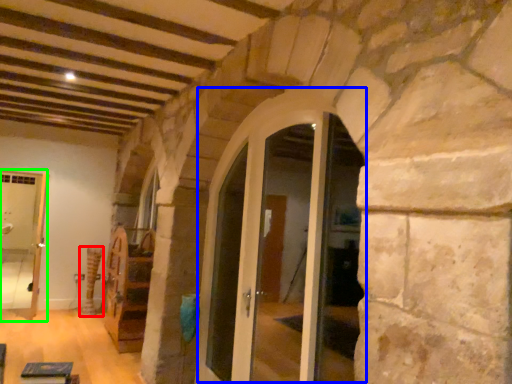
Question: Considering the real-world distances, which object is closest to pillar (highlighted by a red box)? glass door (highlighted by a blue box) or passage (highlighted by a green box).

Choices:
 (A) glass door
 (B) passage

Answer: (B)